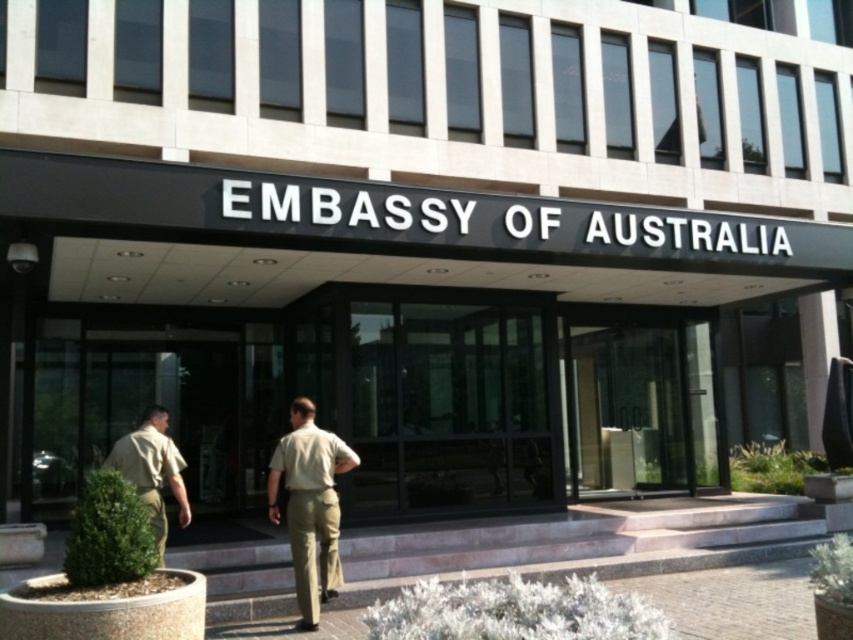
Question: Is transparent glass door at center smaller than khaki fabric pants at center?

Choices:
 (A) yes
 (B) no

Answer: (B)

Question: Which object is farther from the camera taking this photo?

Choices:
 (A) khaki fabric pants at center
 (B) tan uniform at lower left

Answer: (A)

Question: Which object is the closest to the transparent glass door at center?

Choices:
 (A) tan uniform at lower left
 (B) khaki fabric pants at center

Answer: (B)

Question: Which is nearer to the tan uniform at lower left?

Choices:
 (A) transparent glass door at center
 (B) khaki fabric pants at center

Answer: (B)

Question: Can you confirm if khaki fabric pants at center is positioned above tan uniform at lower left?

Choices:
 (A) no
 (B) yes

Answer: (A)

Question: Can you confirm if khaki fabric pants at center is positioned below tan uniform at lower left?

Choices:
 (A) yes
 (B) no

Answer: (A)